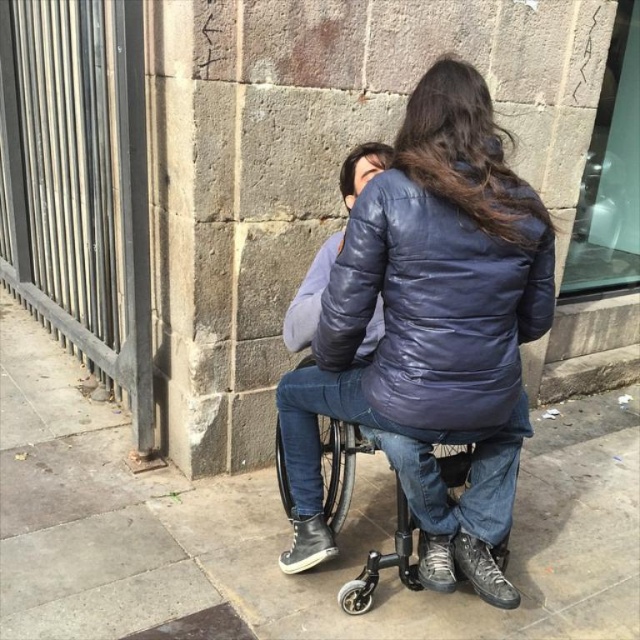
Can you confirm if matte blue jacket at center is wider than black plastic wheelchair at center?

In fact, matte blue jacket at center might be narrower than black plastic wheelchair at center.

Is matte blue jacket at center thinner than black plastic wheelchair at center?

Yes.

At what (x,y) coordinates should I click in order to perform the action: click on matte blue jacket at center. Please return your answer as a coordinate pair (x, y). Image resolution: width=640 pixels, height=640 pixels. Looking at the image, I should click on (435, 307).

You are a GUI agent. You are given a task and a screenshot of the screen. Output one action in this format:
    pyautogui.click(x=<x>, y=<y>)
    Task: Click on the matte blue jacket at center
    This screenshot has width=640, height=640.
    Given the screenshot: What is the action you would take?
    pyautogui.click(x=435, y=307)

Between concrete pavement at center and black plastic wheelchair at center, which one appears on the right side from the viewer's perspective?

Positioned to the right is black plastic wheelchair at center.

Which of these two, concrete pavement at center or black plastic wheelchair at center, stands shorter?

With less height is black plastic wheelchair at center.

Image resolution: width=640 pixels, height=640 pixels. Find the location of `concrete pavement at center`. concrete pavement at center is located at coordinates (280, 529).

Where is `concrete pavement at center`? concrete pavement at center is located at coordinates (280, 529).

Can you confirm if concrete pavement at center is positioned above matte blue jacket at center?

Actually, concrete pavement at center is below matte blue jacket at center.

Where is `concrete pavement at center`? This screenshot has width=640, height=640. concrete pavement at center is located at coordinates (280, 529).

Where is `concrete pavement at center`? concrete pavement at center is located at coordinates (280, 529).